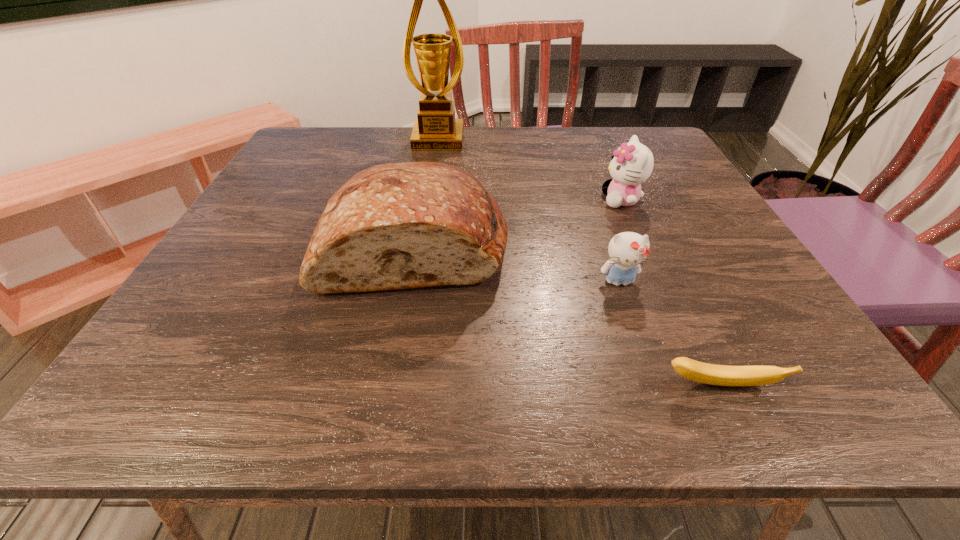
This screenshot has height=540, width=960. What are the coordinates of `vacant space in between the nearer kitten and the second tallest object` in the screenshot? It's located at 516,263.

This screenshot has height=540, width=960. What are the coordinates of `free space between the shorter kitten and the award` in the screenshot? It's located at (529, 211).

Where is `free spot between the nearest object and the farther kitten`? free spot between the nearest object and the farther kitten is located at coordinates (671, 293).

Locate an element on the screen. The height and width of the screenshot is (540, 960). free space between the award and the third shortest object is located at coordinates (530, 170).

Find the location of `empty location between the tallest object and the third shortest object`. empty location between the tallest object and the third shortest object is located at coordinates (530, 170).

Identify the location of free space between the farther kitten and the award. This screenshot has width=960, height=540. (530, 170).

Identify which object is the closest to the farthest object. Please provide its 2D coordinates. Your answer should be formatted as a tuple, i.e. [(x, y)], where the tuple contains the x and y coordinates of a point satisfying the conditions above.

[(405, 225)]

Identify which object is the closest to the fourth shortest object. Please provide its 2D coordinates. Your answer should be formatted as a tuple, i.e. [(x, y)], where the tuple contains the x and y coordinates of a point satisfying the conditions above.

[(627, 250)]